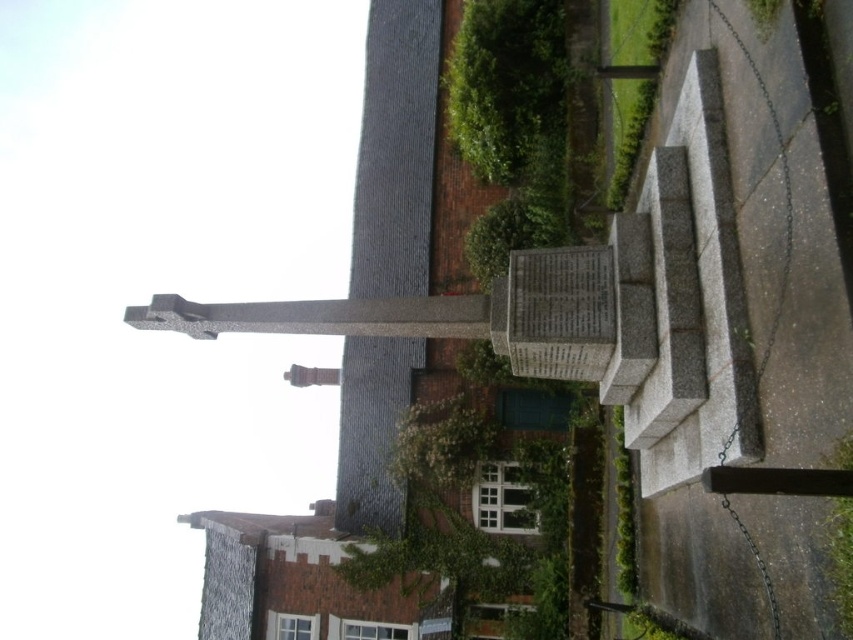
Consider the image. You are a gardener who needs to trim the green leafy plant at lower right without damaging the green mossy stone at upper center. Can you safely reach the plant from below?

The green mossy stone at upper center is positioned over the green leafy plant at lower right, so you can safely trim the plant from below without damaging the stone.

You are a gardener tasked with maintaining the memorial area. You notice two green elements in the scene. Which one has a greater width between the green mossy stone at upper center and the green leafy plant at lower right?

The green mossy stone at upper center has a greater width than the green leafy plant at lower right.